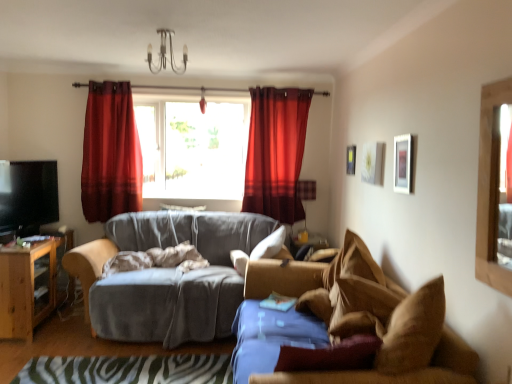
Question: Does brown fabric couch at right, which appears as the second studio couch when viewed from the back, have a lesser height compared to velvet red curtain at upper center, the 2th curtain viewed from the right?

Choices:
 (A) yes
 (B) no

Answer: (A)

Question: Would you say velvet red curtain at upper center, the 2th curtain viewed from the right, is part of brown fabric couch at right, which appears as the second studio couch when viewed from the back,'s contents?

Choices:
 (A) yes
 (B) no

Answer: (B)

Question: Does brown fabric couch at right, the 1th studio couch when ordered from front to back, have a greater height compared to velvet red curtain at upper center, the 2th curtain viewed from the right?

Choices:
 (A) yes
 (B) no

Answer: (B)

Question: Is there a large distance between brown fabric couch at right, which appears as the second studio couch when viewed from the back, and velvet red curtain at upper center, the first curtain viewed from the left?

Choices:
 (A) no
 (B) yes

Answer: (B)

Question: Does brown fabric couch at right, which appears as the second studio couch when viewed from the back, appear on the left side of velvet red curtain at upper center, the 2th curtain viewed from the right?

Choices:
 (A) no
 (B) yes

Answer: (A)

Question: Considering the relative positions of metallic chandelier at upper center and white matte picture frame at upper center, which appears as the second picture frame when viewed from the front, in the image provided, is metallic chandelier at upper center to the left or to the right of white matte picture frame at upper center, which appears as the second picture frame when viewed from the front,?

Choices:
 (A) right
 (B) left

Answer: (B)

Question: From the image's perspective, is metallic chandelier at upper center located above or below white matte picture frame at upper center, which appears as the second picture frame when viewed from the front?

Choices:
 (A) above
 (B) below

Answer: (A)

Question: Choose the correct answer: Is metallic chandelier at upper center inside white matte picture frame at upper center, which is the 2th picture frame from back to front, or outside it?

Choices:
 (A) outside
 (B) inside

Answer: (A)

Question: Is metallic chandelier at upper center wider or thinner than white matte picture frame at upper center, which is the 2th picture frame from back to front?

Choices:
 (A) wide
 (B) thin

Answer: (A)

Question: From their relative heights in the image, would you say white soft pillow at center is taller or shorter than zebra print rug at lower center?

Choices:
 (A) short
 (B) tall

Answer: (B)

Question: Considering their positions, is white soft pillow at center located in front of or behind zebra print rug at lower center?

Choices:
 (A) front
 (B) behind

Answer: (B)

Question: Choose the correct answer: Is white soft pillow at center inside zebra print rug at lower center or outside it?

Choices:
 (A) inside
 (B) outside

Answer: (B)

Question: In terms of size, does white soft pillow at center appear bigger or smaller than zebra print rug at lower center?

Choices:
 (A) small
 (B) big

Answer: (B)

Question: Looking at their shapes, would you say velvet red curtain at upper center, the first curtain viewed from the left, is wider or thinner than zebra print rug at lower center?

Choices:
 (A) wide
 (B) thin

Answer: (B)

Question: From the image's perspective, relative to zebra print rug at lower center, is velvet red curtain at upper center, the first curtain viewed from the left, above or below?

Choices:
 (A) below
 (B) above

Answer: (B)